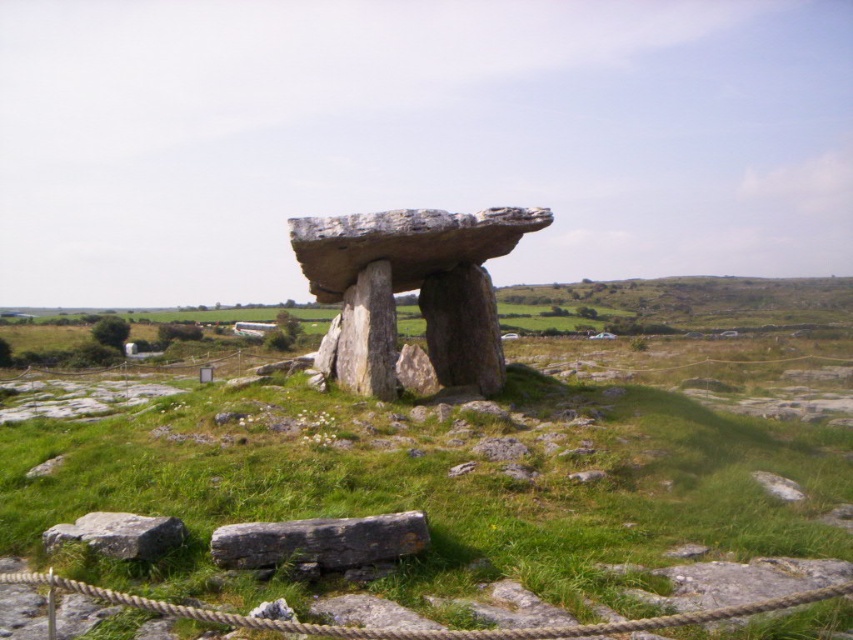
Is green grassy at center in front of rough stone dolmen at center?

Yes.

Does green grassy at center have a greater width compared to rough stone dolmen at center?

Yes, green grassy at center is wider than rough stone dolmen at center.

The image size is (853, 640). I want to click on green grassy at center, so click(474, 486).

The image size is (853, 640). I want to click on green grassy at center, so [474, 486].

Is roperough at lower center to the right of gray rough stone at lower left from the viewer's perspective?

Correct, you'll find roperough at lower center to the right of gray rough stone at lower left.

Where is `roperough at lower center`? roperough at lower center is located at coordinates (425, 628).

This screenshot has width=853, height=640. What do you see at coordinates (320, 540) in the screenshot?
I see `gray rough stone at lower center` at bounding box center [320, 540].

Who is more distant from viewer, [292,525] or [171,516]?

Point [171,516]

What are the coordinates of `gray rough stone at lower center` in the screenshot? It's located at (320, 540).